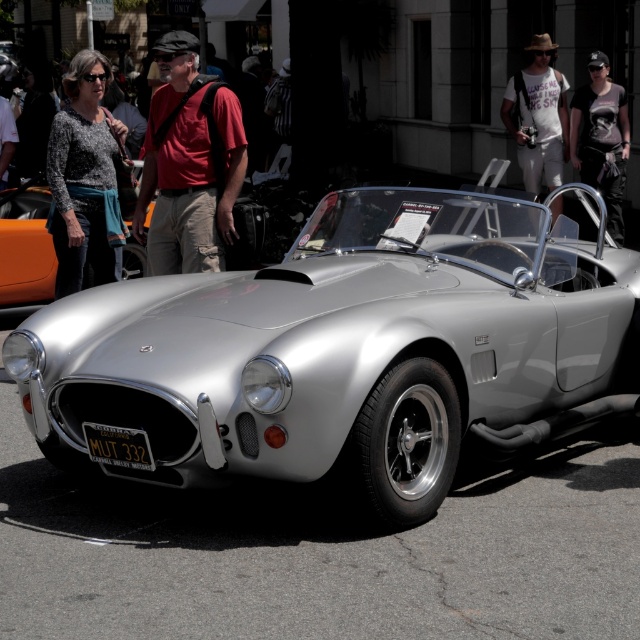
Question: Which object is farther from the camera taking this photo?

Choices:
 (A) white cotton shirt at upper center
 (B) black metal license plate at center
 (C) speckled sweater at upper left

Answer: (A)

Question: Considering the real-world distances, which object is farthest from the matte black shirt at center?

Choices:
 (A) matte red shirt at center
 (B) black metal license plate at center
 (C) silver metallic car at center

Answer: (C)

Question: Does speckled sweater at upper left have a greater width compared to black metal license plate at center?

Choices:
 (A) yes
 (B) no

Answer: (A)

Question: Does black metal license plate at center have a smaller size compared to matte black shirt at center?

Choices:
 (A) yes
 (B) no

Answer: (A)

Question: Is silver metallic car at center smaller than white cotton shirt at upper center?

Choices:
 (A) yes
 (B) no

Answer: (B)

Question: Which object is closer to the camera taking this photo?

Choices:
 (A) silver metallic car at center
 (B) white cotton shirt at upper center
 (C) matte black shirt at center

Answer: (A)